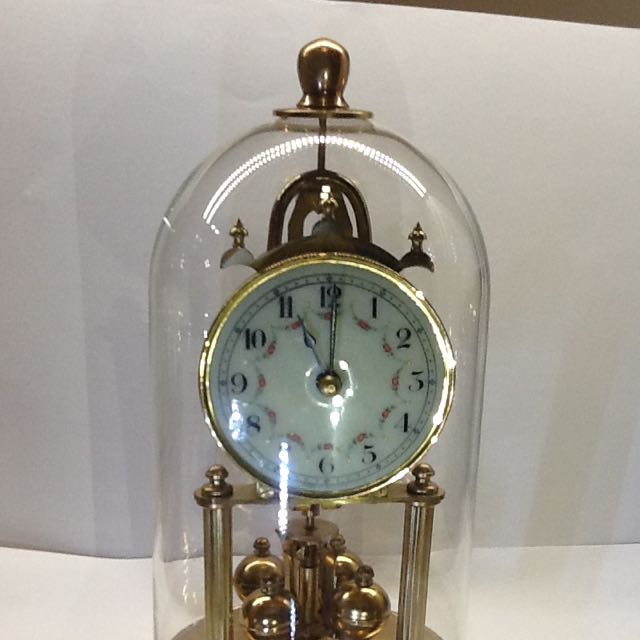
The height and width of the screenshot is (640, 640). In order to click on glass in this screenshot , I will do `click(252, 203)`.